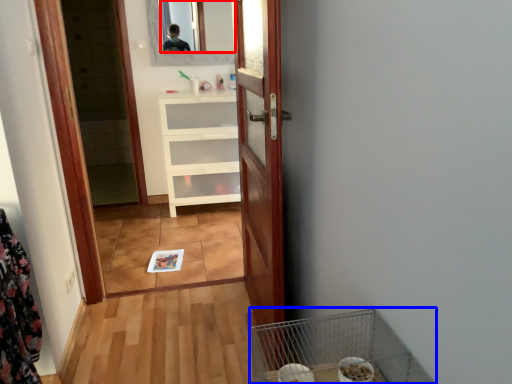
Question: Which of the following is the farthest to the observer, mirror (highlighted by a red box) or bird cage (highlighted by a blue box)?

Choices:
 (A) mirror
 (B) bird cage

Answer: (A)